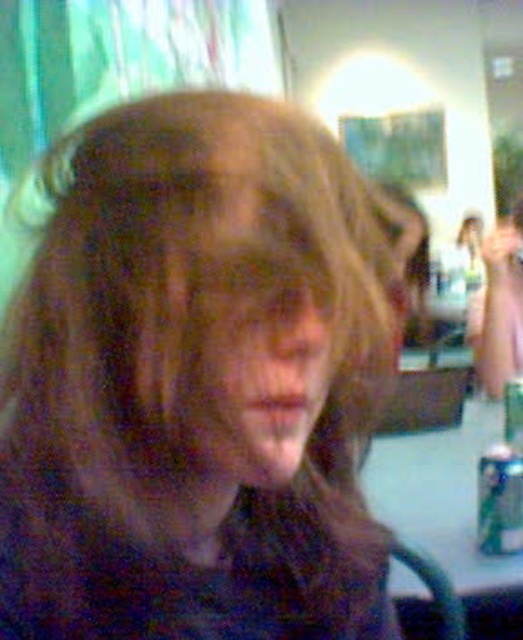
Question: Estimate the real-world distances between objects in this image. Which object is farther from the green matte can at lower right?

Choices:
 (A) brown matte hair at center
 (B) smooth skin face at center

Answer: (B)

Question: Can you confirm if brown matte hair at center is positioned to the right of green matte can at lower right?

Choices:
 (A) no
 (B) yes

Answer: (A)

Question: Which point is farther from the camera taking this photo?

Choices:
 (A) (77, 518)
 (B) (518, 452)
 (C) (244, 369)

Answer: (B)

Question: Is brown matte hair at center wider than smooth skin face at center?

Choices:
 (A) no
 (B) yes

Answer: (B)

Question: Considering the real-world distances, which object is closest to the smooth skin face at center?

Choices:
 (A) green matte can at lower right
 (B) brown matte hair at center

Answer: (B)

Question: Can you confirm if smooth skin face at center is bigger than green matte can at lower right?

Choices:
 (A) no
 (B) yes

Answer: (A)